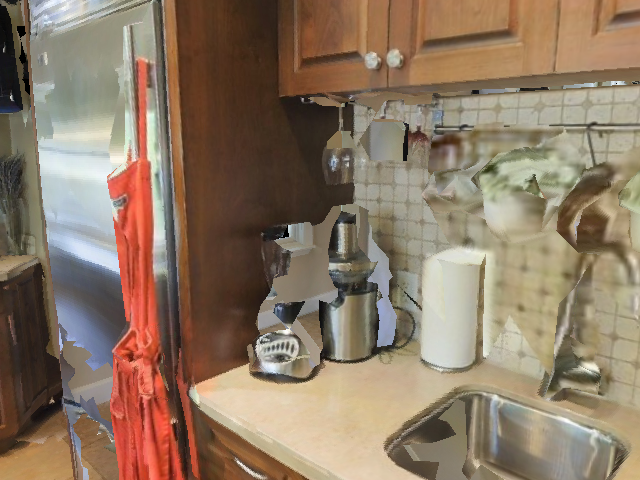
Find the location of a particular element. The image size is (640, 480). fridge is located at coordinates (79, 140).